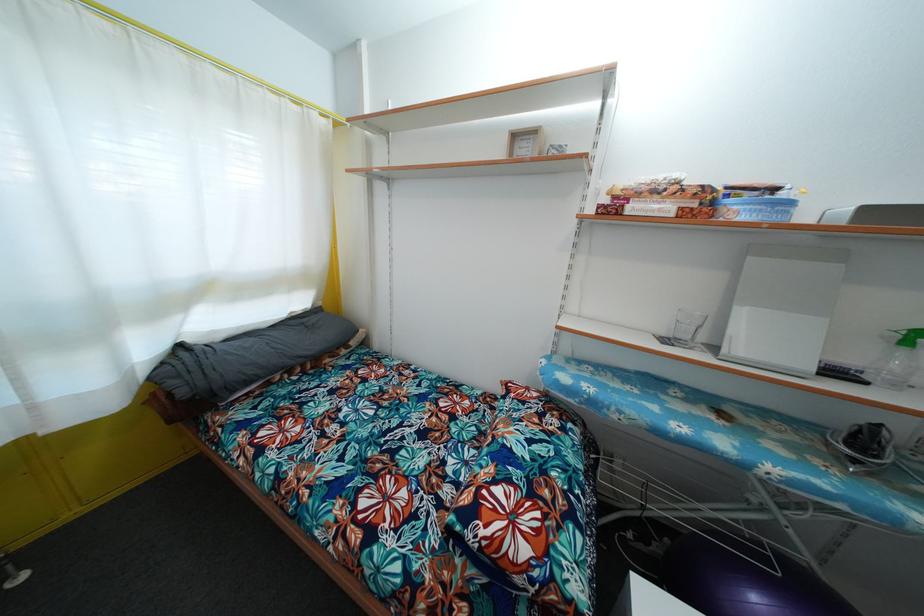
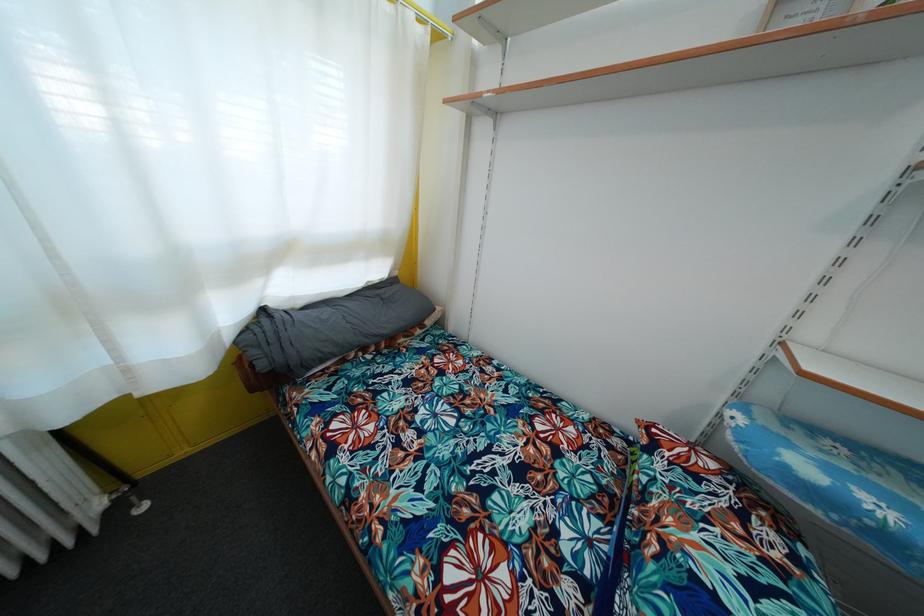
Question: Based on the continuous images, in which direction is the camera rotating? Reply with the corresponding letter.

Choices:
 (A) Left
 (B) Right
 (C) Up
 (D) Down

Answer: (A)